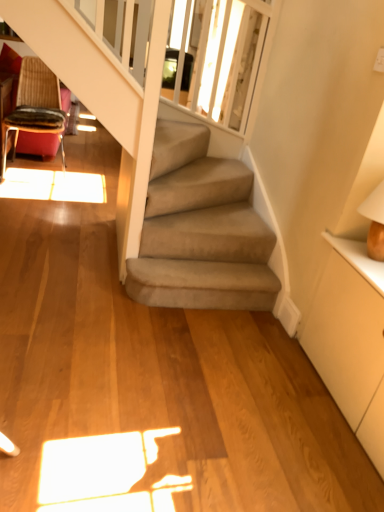
Question: From the image's perspective, is wooden textured chair at upper left beneath translucent glass window screen at upper center?

Choices:
 (A) no
 (B) yes

Answer: (B)

Question: Can you confirm if wooden textured chair at upper left is wider than translucent glass window screen at upper center?

Choices:
 (A) yes
 (B) no

Answer: (A)

Question: Is translucent glass window screen at upper center located within wooden textured chair at upper left?

Choices:
 (A) yes
 (B) no

Answer: (B)

Question: Can you confirm if wooden textured chair at upper left is shorter than translucent glass window screen at upper center?

Choices:
 (A) yes
 (B) no

Answer: (A)

Question: Can we say wooden textured chair at upper left lies outside translucent glass window screen at upper center?

Choices:
 (A) no
 (B) yes

Answer: (B)

Question: From a real-world perspective, is wooden textured chair at upper left positioned above or below white matte dresser at right?

Choices:
 (A) below
 (B) above

Answer: (B)

Question: In terms of width, does wooden textured chair at upper left look wider or thinner when compared to white matte dresser at right?

Choices:
 (A) thin
 (B) wide

Answer: (B)

Question: Considering the positions of wooden textured chair at upper left and white matte dresser at right in the image, is wooden textured chair at upper left bigger or smaller than white matte dresser at right?

Choices:
 (A) big
 (B) small

Answer: (A)

Question: Is wooden textured chair at upper left situated inside white matte dresser at right or outside?

Choices:
 (A) outside
 (B) inside

Answer: (A)

Question: Is white matte dresser at right bigger or smaller than translucent glass window screen at upper center?

Choices:
 (A) big
 (B) small

Answer: (A)

Question: Is white matte dresser at right to the left or to the right of translucent glass window screen at upper center in the image?

Choices:
 (A) right
 (B) left

Answer: (A)

Question: From a real-world perspective, is white matte dresser at right above or below translucent glass window screen at upper center?

Choices:
 (A) above
 (B) below

Answer: (B)

Question: Does point (375, 385) appear closer or farther from the camera than point (223, 111)?

Choices:
 (A) farther
 (B) closer

Answer: (B)

Question: From the image's perspective, is translucent glass window screen at upper center located above or below wooden textured chair at upper left?

Choices:
 (A) above
 (B) below

Answer: (A)

Question: From a real-world perspective, is translucent glass window screen at upper center above or below wooden textured chair at upper left?

Choices:
 (A) below
 (B) above

Answer: (B)